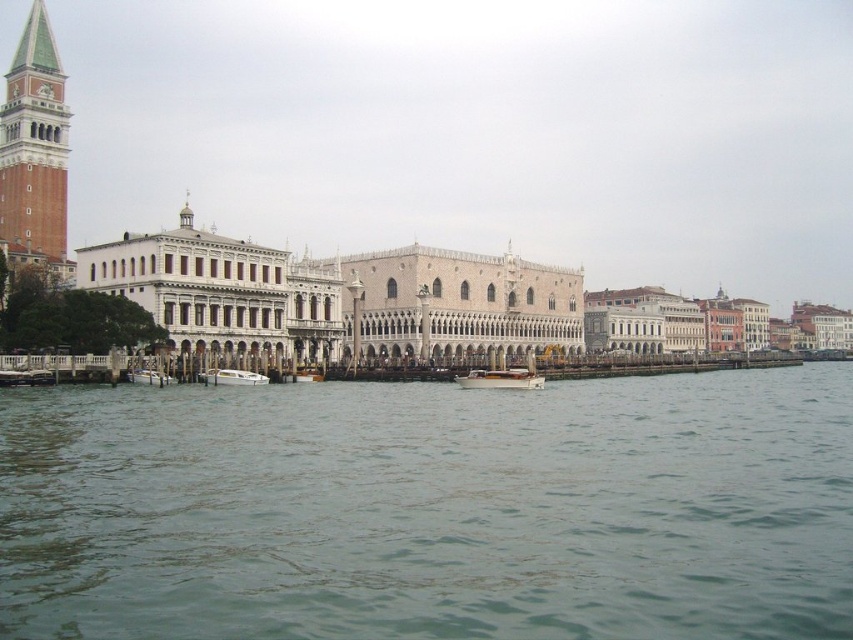
Question: Does white glossy boat at center appear on the left side of white matte boat at lower left?

Choices:
 (A) yes
 (B) no

Answer: (B)

Question: Which point is farther to the camera?

Choices:
 (A) tap(148, 376)
 (B) tap(228, 378)
 (C) tap(477, 385)
 (D) tap(393, 314)

Answer: (D)

Question: Estimate the real-world distances between objects in this image. Which object is farther from the golden mosaic palace at center?

Choices:
 (A) white matte boat at lower left
 (B) wooden polished boat at center

Answer: (A)

Question: Estimate the real-world distances between objects in this image. Which object is closer to the wooden polished boat at center?

Choices:
 (A) white matte boat at lower left
 (B) greenish water at center

Answer: (B)

Question: From the image, what is the correct spatial relationship of wooden polished boat at center in relation to white glossy boat at center?

Choices:
 (A) above
 (B) below

Answer: (B)

Question: Is greenish water at center to the left of golden mosaic palace at center from the viewer's perspective?

Choices:
 (A) yes
 (B) no

Answer: (B)